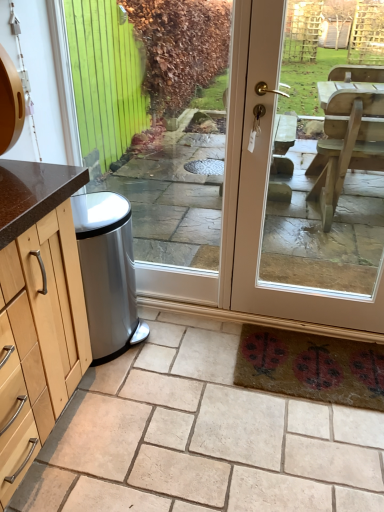
Question: Is satin silver trash can at lower left at the left side of clear glass door at center?

Choices:
 (A) no
 (B) yes

Answer: (A)

Question: Can you confirm if satin silver trash can at lower left is shorter than clear glass door at center?

Choices:
 (A) yes
 (B) no

Answer: (B)

Question: Is satin silver trash can at lower left facing towards clear glass door at center?

Choices:
 (A) yes
 (B) no

Answer: (A)

Question: From a real-world perspective, is satin silver trash can at lower left physically below clear glass door at center?

Choices:
 (A) yes
 (B) no

Answer: (A)

Question: Is satin silver trash can at lower left outside clear glass door at center?

Choices:
 (A) yes
 (B) no

Answer: (B)

Question: From the image's perspective, is satin silver trash can at lower left located above or below matte beige door at center?

Choices:
 (A) above
 (B) below

Answer: (A)

Question: Is satin silver trash can at lower left to the left or to the right of matte beige door at center in the image?

Choices:
 (A) right
 (B) left

Answer: (B)

Question: Relative to matte beige door at center, is satin silver trash can at lower left in front or behind?

Choices:
 (A) front
 (B) behind

Answer: (B)

Question: In terms of size, does satin silver trash can at lower left appear bigger or smaller than matte beige door at center?

Choices:
 (A) small
 (B) big

Answer: (B)

Question: In the image, is matte beige door at center on the left side or the right side of clear glass door at center?

Choices:
 (A) right
 (B) left

Answer: (A)

Question: Considering the positions of point (243, 198) and point (198, 150), is point (243, 198) closer or farther from the camera than point (198, 150)?

Choices:
 (A) farther
 (B) closer

Answer: (B)

Question: From a real-world perspective, is matte beige door at center physically located above or below clear glass door at center?

Choices:
 (A) above
 (B) below

Answer: (B)

Question: In the image, is matte beige door at center positioned in front of or behind clear glass door at center?

Choices:
 (A) behind
 (B) front

Answer: (B)

Question: From a real-world perspective, relative to matte beige door at center, is clear glass door at center vertically above or below?

Choices:
 (A) above
 (B) below

Answer: (A)

Question: Is clear glass door at center bigger or smaller than matte beige door at center?

Choices:
 (A) small
 (B) big

Answer: (A)